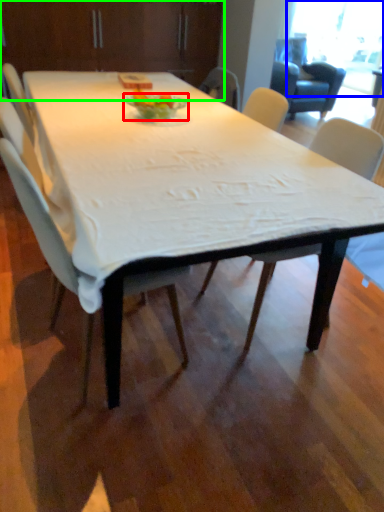
Question: Which is nearer to the plate (highlighted by a red box)? window screen (highlighted by a blue box) or dresser (highlighted by a green box).

Choices:
 (A) window screen
 (B) dresser

Answer: (B)